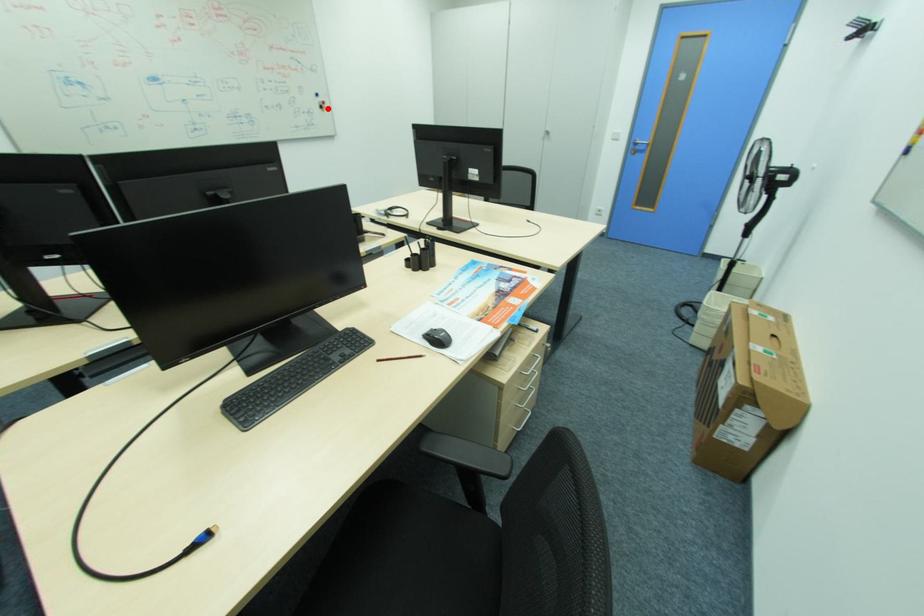
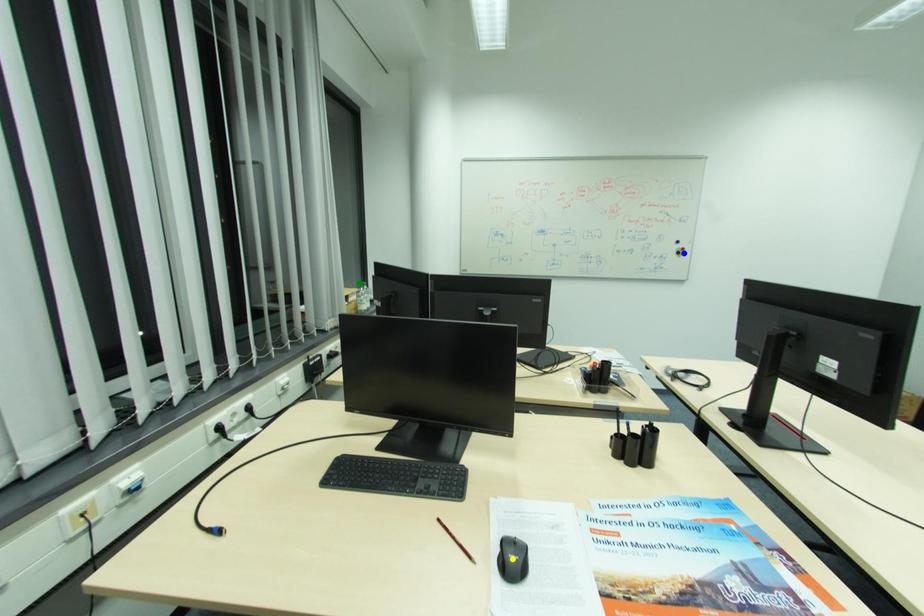
Question: I am providing you with two images of the same scene from different viewpoints. A red point is marked on the first image. You are given multiple points on the second image. Which spot in image 2 lines up with the point in image 1?

Choices:
 (A) yellow point
 (B) blue point
 (C) green point

Answer: (B)